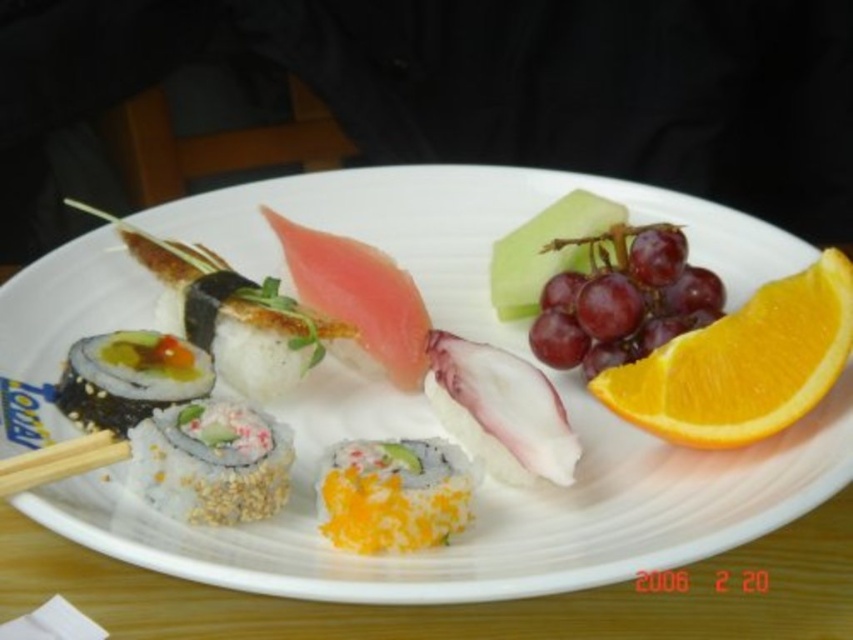
Is white glossy plate at center smaller than pink raw fish at center?

Actually, white glossy plate at center might be larger than pink raw fish at center.

Is point (554, 513) positioned before point (360, 337)?

Yes, it is.

You are a GUI agent. You are given a task and a screenshot of the screen. Output one action in this format:
    pyautogui.click(x=<x>, y=<y>)
    Task: Click on the white glossy plate at center
    This screenshot has height=640, width=853.
    Given the screenshot: What is the action you would take?
    pyautogui.click(x=480, y=506)

Between shiny purple grapes at upper right and yellow rice at center, which one has less height?

yellow rice at center

Can you confirm if shiny purple grapes at upper right is wider than yellow rice at center?

Indeed, shiny purple grapes at upper right has a greater width compared to yellow rice at center.

Describe the element at coordinates (622, 300) in the screenshot. This screenshot has width=853, height=640. I see `shiny purple grapes at upper right` at that location.

Identify the location of shiny purple grapes at upper right. The width and height of the screenshot is (853, 640). (622, 300).

Is shiny purple grapes at upper right below sushi at center?

No.

Is shiny purple grapes at upper right positioned behind sushi at center?

That is False.

Does point (639, 308) lie behind point (250, 292)?

No.

Where is `shiny purple grapes at upper right`? shiny purple grapes at upper right is located at coordinates (622, 300).